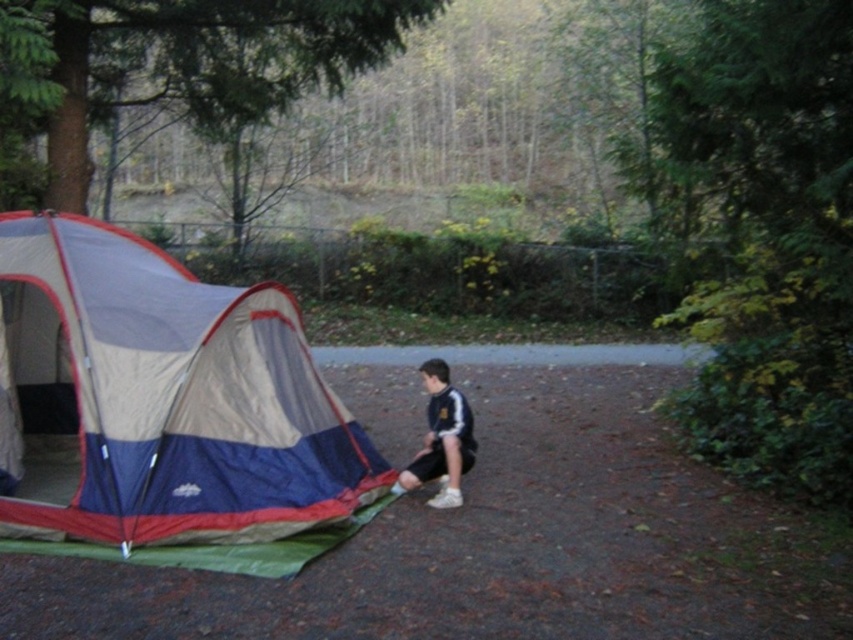
You are a hiker who just arrived at the campsite and need to put your dark blue jersey at center away. Where should you place it relative to the blue fabric tent at left?

Since the blue fabric tent at left is closer to you than the dark blue jersey at center, you should place the dark blue jersey at center behind the blue fabric tent at left to keep it organized.

You are a hiker who needs to place a small backpack between the blue fabric tent at left and the dark blue jersey at center. Based on their positions, where should you place the backpack?

The blue fabric tent at left is located above the dark blue jersey at center, so you should place the backpack between them below the tent and above the jersey.

You are a photographer trying to capture a closeup shot of the tent entrance. You have two points marked in the scene, point [97,397] and point [450,465]. Which point should you focus on to ensure the tent entrance is in focus?

Point [97,397] is closer to the camera than point [450,465], so focusing on point [97,397] will ensure the tent entrance is in focus.